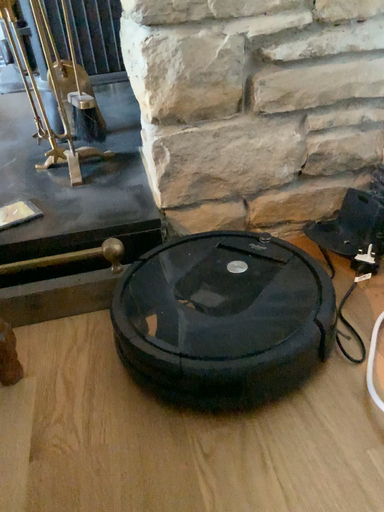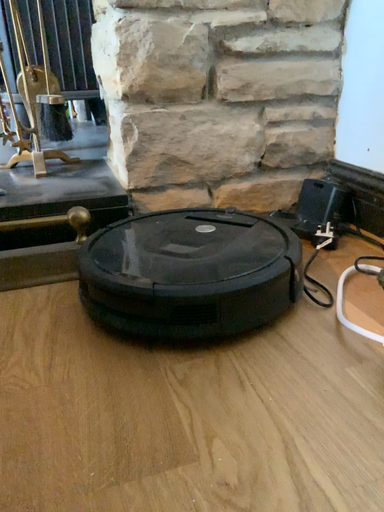
Question: How did the camera likely rotate when shooting the video?

Choices:
 (A) rotated downward
 (B) rotated upward

Answer: (B)